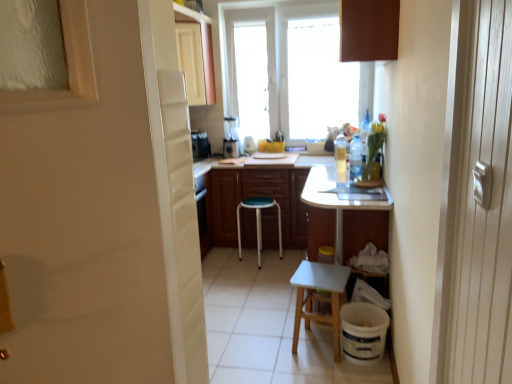
Where is `vacant space situated on the left part of white wood stool at lower center, the 2th stool when ordered from back to front`? vacant space situated on the left part of white wood stool at lower center, the 2th stool when ordered from back to front is located at coordinates [x=275, y=351].